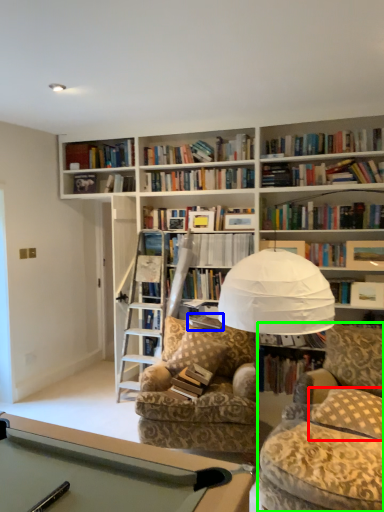
Question: Estimate the real-world distances between objects in this image. Which object is closer to pillow (highlighted by a red box), paperback book (highlighted by a blue box) or swivel chair (highlighted by a green box)?

Choices:
 (A) paperback book
 (B) swivel chair

Answer: (B)